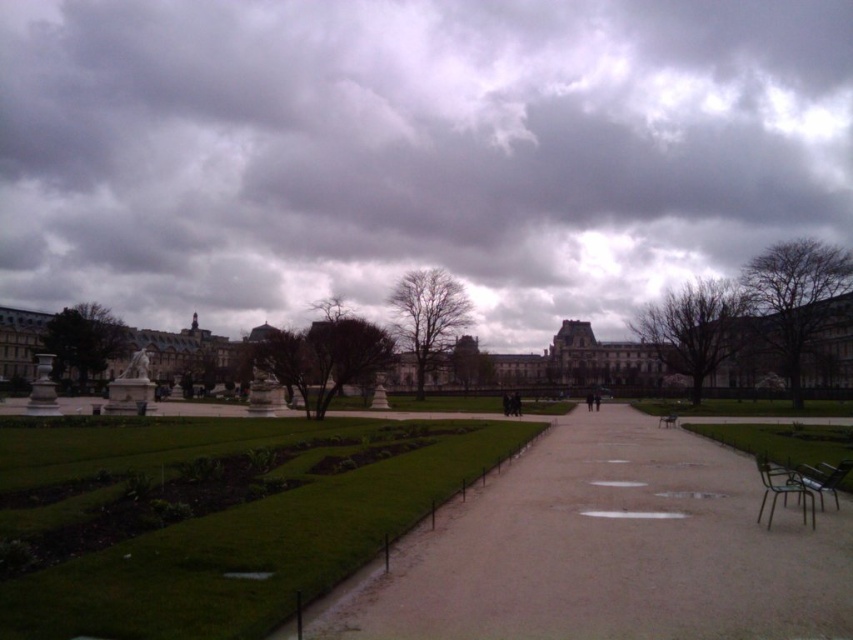
Question: Which object is closer to the camera taking this photo?

Choices:
 (A) cloudy sky at upper center
 (B) wooden park bench at center

Answer: (B)

Question: Which point is farther to the camera?

Choices:
 (A) (247, 492)
 (B) (621, 636)
 (C) (663, 416)

Answer: (C)

Question: Does gray concrete pathway at center appear under wooden park bench at center?

Choices:
 (A) yes
 (B) no

Answer: (B)

Question: Can you confirm if green grass at center is wider than wooden park bench at center?

Choices:
 (A) no
 (B) yes

Answer: (B)

Question: Which point is closer to the camera taking this photo?

Choices:
 (A) (97, 202)
 (B) (299, 545)
 (C) (666, 417)

Answer: (B)

Question: Does cloudy sky at upper center appear on the left side of gray concrete pathway at center?

Choices:
 (A) yes
 (B) no

Answer: (A)